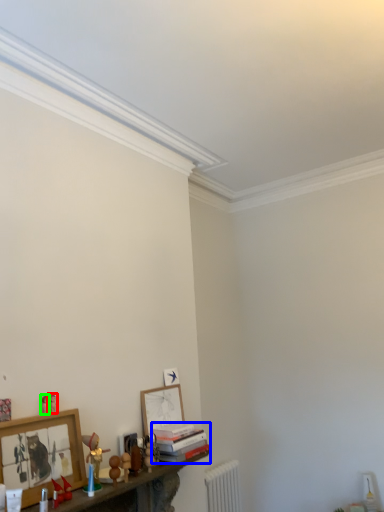
Question: Based on their relative distances, which object is farther from toy (highlighted by a red box)? Choose from book (highlighted by a blue box) and toy (highlighted by a green box).

Choices:
 (A) book
 (B) toy

Answer: (A)